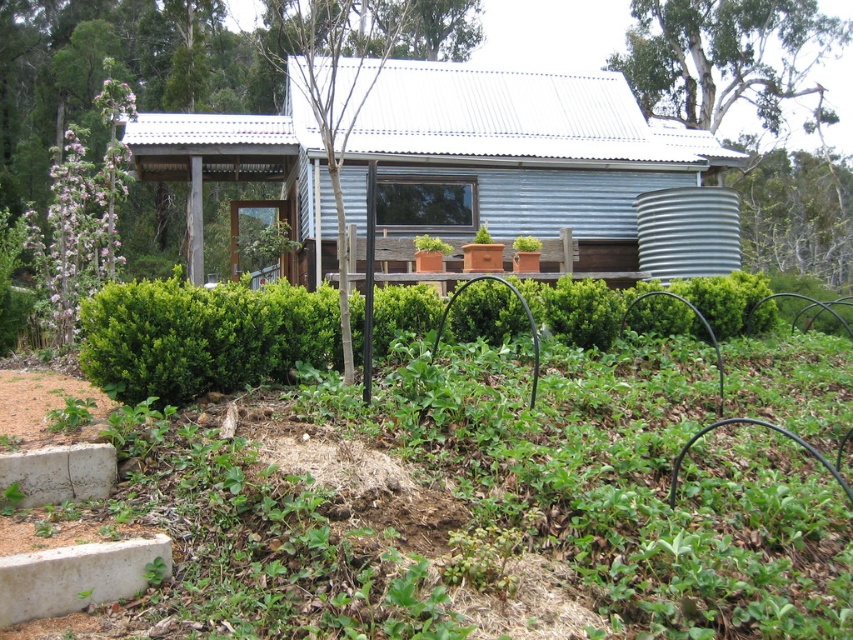
Question: Which of the following is the farthest from the observer?

Choices:
 (A) white bark tree at upper right
 (B) green leafy hedge at center

Answer: (A)

Question: Is green leafy hedge at center further to the viewer compared to white bark tree at upper right?

Choices:
 (A) yes
 (B) no

Answer: (B)

Question: Does green leafy hedge at center appear on the right side of white bark tree at upper right?

Choices:
 (A) no
 (B) yes

Answer: (A)

Question: Which point appears farthest from the camera in this image?

Choices:
 (A) (119, 381)
 (B) (622, 60)

Answer: (B)

Question: Does green leafy hedge at center appear on the left side of white bark tree at upper right?

Choices:
 (A) yes
 (B) no

Answer: (A)